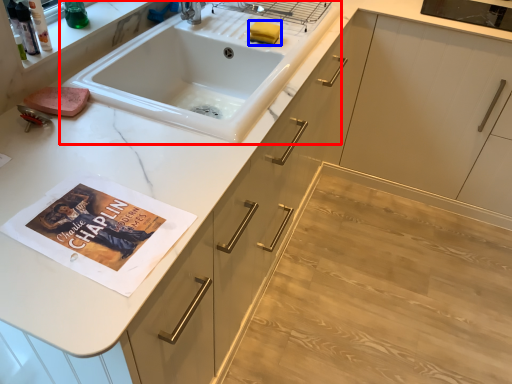
Question: Which object appears farthest to the camera in this image, sink (highlighted by a red box) or soap (highlighted by a blue box)?

Choices:
 (A) sink
 (B) soap

Answer: (B)